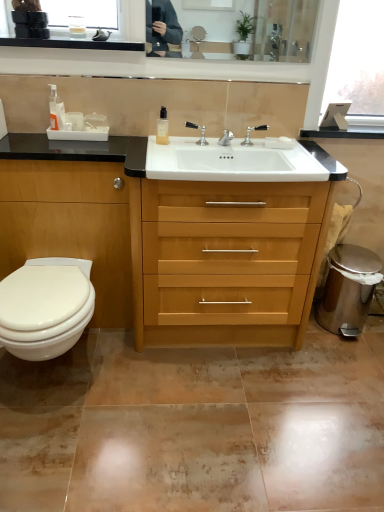
The width and height of the screenshot is (384, 512). Find the location of `vacant area situated below white glossy toilet at lower left (from a real-world perspective)`. vacant area situated below white glossy toilet at lower left (from a real-world perspective) is located at coordinates (57, 377).